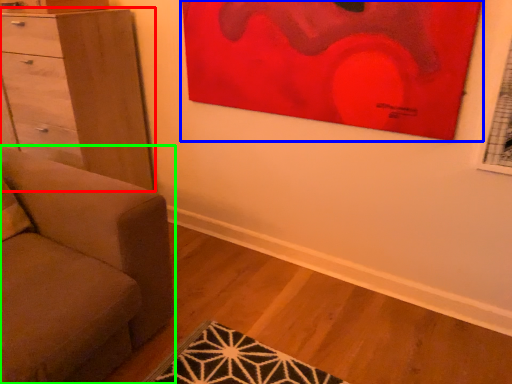
Question: Estimate the real-world distances between objects in this image. Which object is closer to chest of drawers (highlighted by a red box), picture frame (highlighted by a blue box) or studio couch (highlighted by a green box)?

Choices:
 (A) picture frame
 (B) studio couch

Answer: (B)